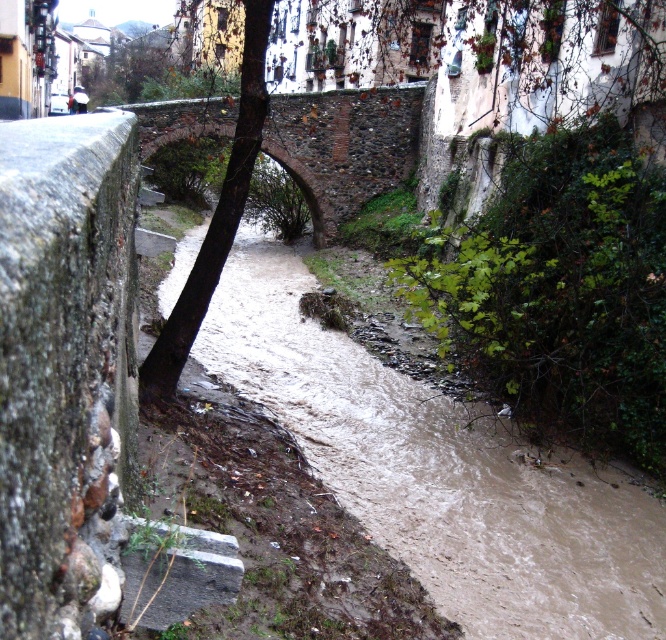
Between point (324, 136) and point (182, 301), which one is positioned in front?

Point (182, 301) is more forward.

Is stone arch bridge at center above brown rough tree trunk at center?

Correct, stone arch bridge at center is located above brown rough tree trunk at center.

This screenshot has height=640, width=666. What do you see at coordinates (344, 147) in the screenshot? I see `stone arch bridge at center` at bounding box center [344, 147].

Where is `stone arch bridge at center`? This screenshot has width=666, height=640. stone arch bridge at center is located at coordinates (344, 147).